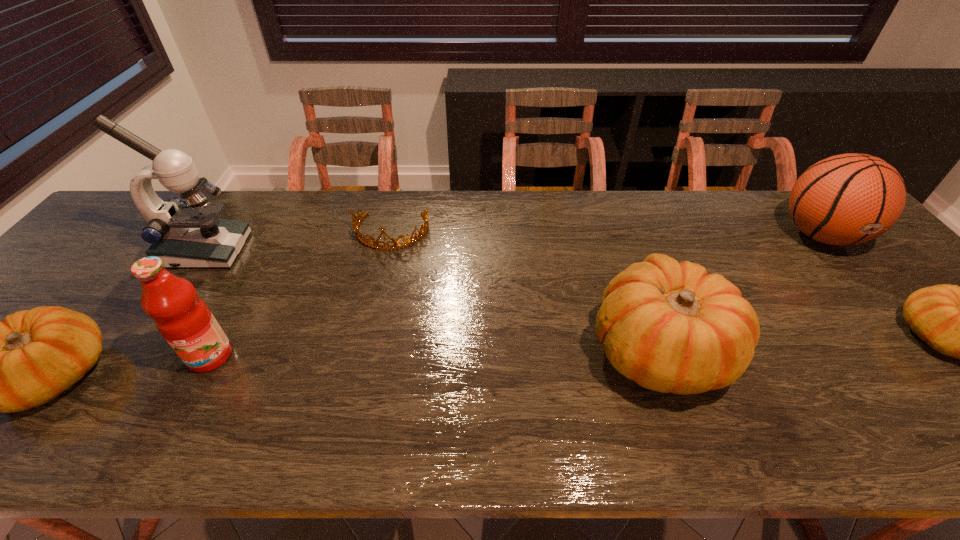
The image size is (960, 540). In order to click on the fourth shortest object in this screenshot , I will do `click(671, 327)`.

Where is `the third object from right to left`? This screenshot has width=960, height=540. the third object from right to left is located at coordinates (671, 327).

Identify the location of tiara. (356, 223).

This screenshot has width=960, height=540. What are the coordinates of `the fourth object from left to right` in the screenshot? It's located at (356, 223).

Locate an element on the screen. Image resolution: width=960 pixels, height=540 pixels. basketball is located at coordinates (847, 199).

In order to click on the tallest object in this screenshot , I will do `click(183, 234)`.

Where is `the fifth object from right to left`? the fifth object from right to left is located at coordinates (184, 320).

Identify the location of free space located on the back of the fifth object from left to right. (626, 255).

The image size is (960, 540). Identify the location of free region located 0.130m on the front-facing side of the fourth object from right to left. pyautogui.click(x=379, y=287).

Image resolution: width=960 pixels, height=540 pixels. What are the coordinates of `free space located on the side where the inflation valve is located` in the screenshot? It's located at (924, 357).